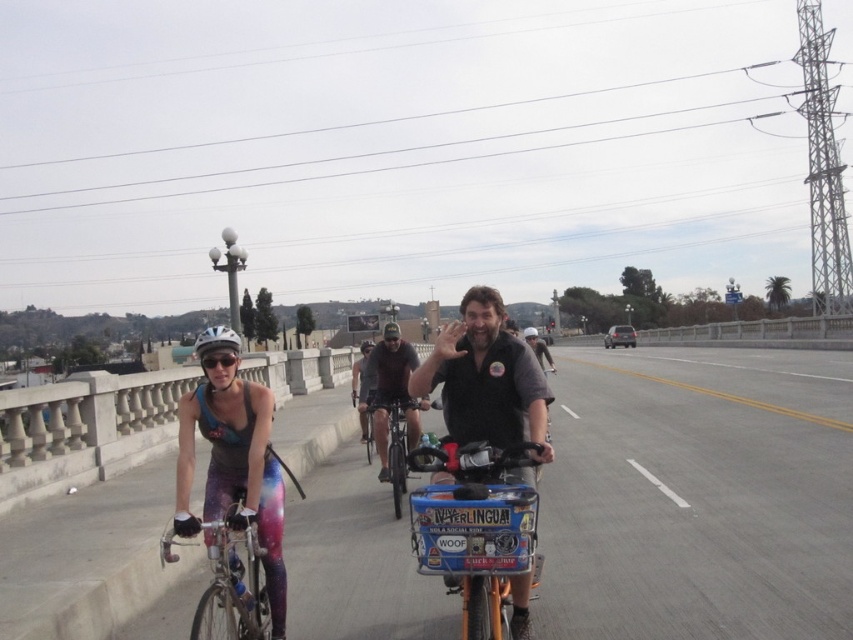
Which is behind, point (398, 419) or point (361, 428)?

The point (361, 428) is more distant.

Between shiny metallic bicycle at center and metallic silver bicycle at center, which one is positioned lower?

metallic silver bicycle at center

Does point (370, 442) come closer to viewer compared to point (352, 392)?

Yes, point (370, 442) is in front of point (352, 392).

This screenshot has height=640, width=853. What are the coordinates of `shiny metallic bicycle at center` in the screenshot? It's located at (399, 448).

Between gray asphalt highway at center and dark brown leather jacket at center, which one is positioned higher?

Positioned higher is dark brown leather jacket at center.

Who is more forward, (x=567, y=588) or (x=534, y=339)?

Point (x=567, y=588) is in front.

The height and width of the screenshot is (640, 853). I want to click on gray asphalt highway at center, so click(699, 496).

From the picture: Who is positioned more to the left, matte gray bicycle at center or dark brown leather jacket at center?

matte gray bicycle at center is more to the left.

Does matte gray bicycle at center appear under dark brown leather jacket at center?

Yes, matte gray bicycle at center is below dark brown leather jacket at center.

Where is `matte gray bicycle at center`? matte gray bicycle at center is located at coordinates (392, 390).

This screenshot has width=853, height=640. Find the location of `matte gray bicycle at center`. matte gray bicycle at center is located at coordinates 392,390.